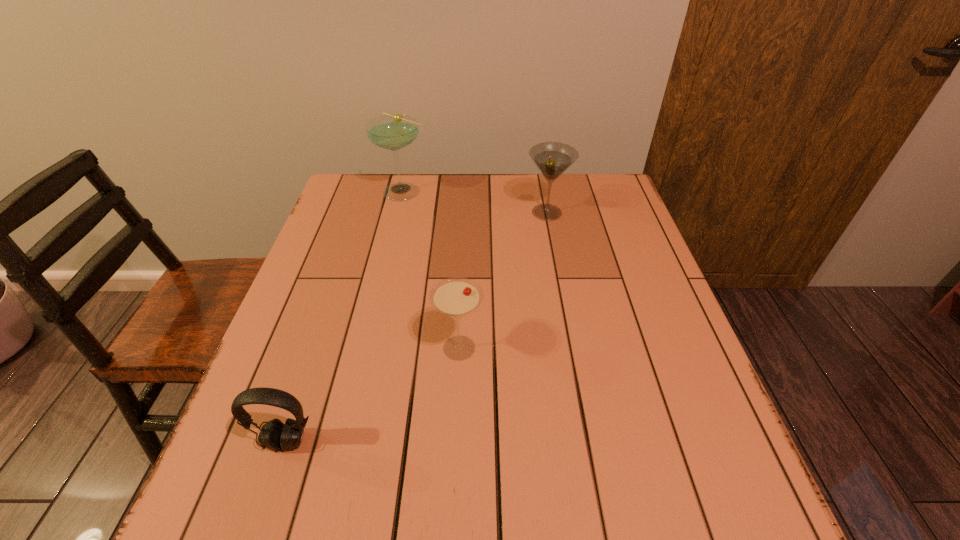
Identify the location of the leftmost martini. (393, 132).

You are a GUI agent. You are given a task and a screenshot of the screen. Output one action in this format:
    pyautogui.click(x=<x>, y=<y>)
    Task: Click on the rightmost martini
    
    Given the screenshot: What is the action you would take?
    click(552, 158)

Identify the location of the nearest martini. (456, 297).

Find the location of `the third farthest object`. the third farthest object is located at coordinates (456, 297).

Where is `the nearest object`? Image resolution: width=960 pixels, height=540 pixels. the nearest object is located at coordinates (274, 435).

This screenshot has width=960, height=540. In order to click on vacant region located 0.180m on the right of the leftmost martini in this screenshot , I will do click(x=490, y=192).

Find the location of a particular element. This screenshot has width=960, height=540. free space located 0.090m on the left of the rightmost martini is located at coordinates (493, 213).

Image resolution: width=960 pixels, height=540 pixels. In order to click on vacant region located 0.250m on the front of the nearest martini in this screenshot , I will do `click(453, 495)`.

Image resolution: width=960 pixels, height=540 pixels. I want to click on free location located 0.120m on the front-facing side of the nearest object, so (256, 529).

I want to click on martini positioned at the left edge, so click(393, 132).